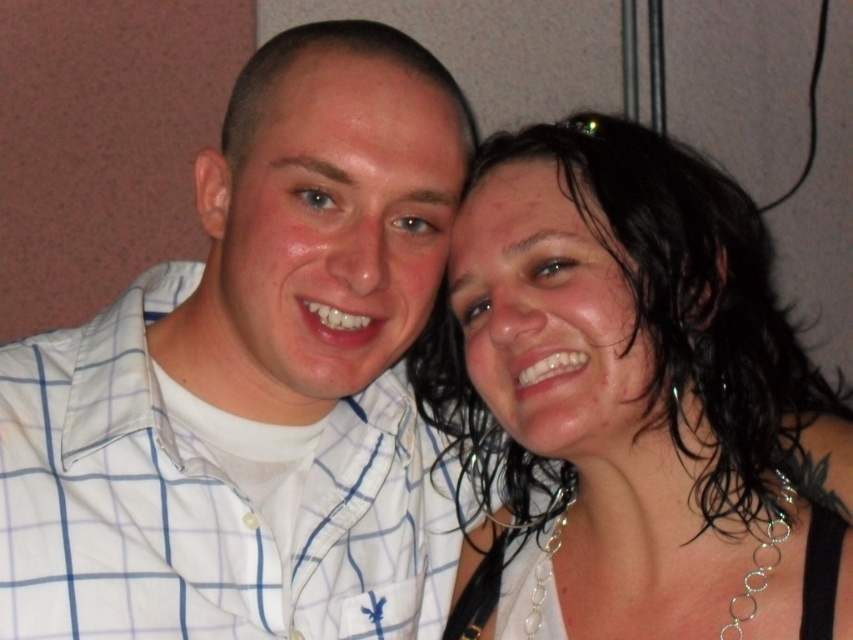
Between white checkered shirt at center and matte white shirt at center, which one has more height?

With more height is white checkered shirt at center.

Does white checkered shirt at center appear on the left side of matte white shirt at center?

Correct, you'll find white checkered shirt at center to the left of matte white shirt at center.

Is point (397, 227) positioned after point (323, 106)?

That is True.

The image size is (853, 640). In order to click on white checkered shirt at center in this screenshot , I will do `click(251, 376)`.

Between white checkered shirt at center and wet hair at center, which one is positioned lower?

wet hair at center is lower down.

Which is behind, point (318, 289) or point (816, 381)?

Point (816, 381)

Between point (86, 436) and point (785, 550), which one is positioned in front?

Positioned in front is point (785, 550).

The image size is (853, 640). I want to click on white checkered shirt at center, so click(251, 376).

Does wet hair at center have a lesser width compared to matte white shirt at center?

No, wet hair at center is not thinner than matte white shirt at center.

Between point (625, 625) and point (329, 61), which one is positioned in front?

Point (329, 61)

Locate an element on the screen. The width and height of the screenshot is (853, 640). wet hair at center is located at coordinates [x=630, y=400].